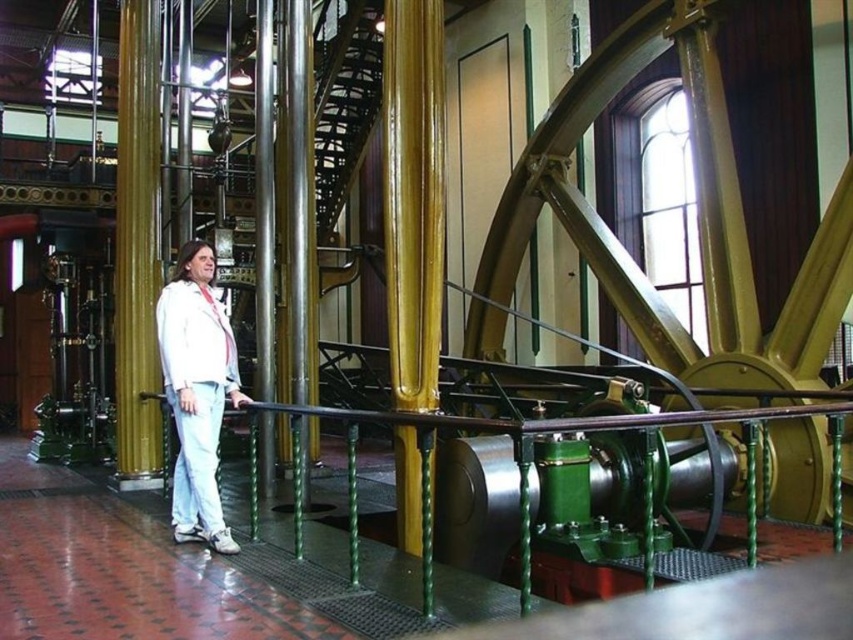
Question: Considering the relative positions of gold polished metal pole at center and green polished metal railing at center in the image provided, where is gold polished metal pole at center located with respect to green polished metal railing at center?

Choices:
 (A) below
 (B) above

Answer: (B)

Question: Is gold polished metal pole at center closer to the viewer compared to white matte lab coat at center?

Choices:
 (A) yes
 (B) no

Answer: (A)

Question: Is gold polished metal pole at center above gold polished pillar at center?

Choices:
 (A) yes
 (B) no

Answer: (B)

Question: Which object appears farthest from the camera in this image?

Choices:
 (A) green polished metal railing at center
 (B) white matte lab coat at center
 (C) polished metal pillar at center

Answer: (C)

Question: Which object is positioned closest to the gold polished metal pole at center?

Choices:
 (A) polished metal pillar at center
 (B) gold polished pillar at center

Answer: (A)

Question: Which point is closer to the camera?

Choices:
 (A) (178, 368)
 (B) (123, 129)

Answer: (A)